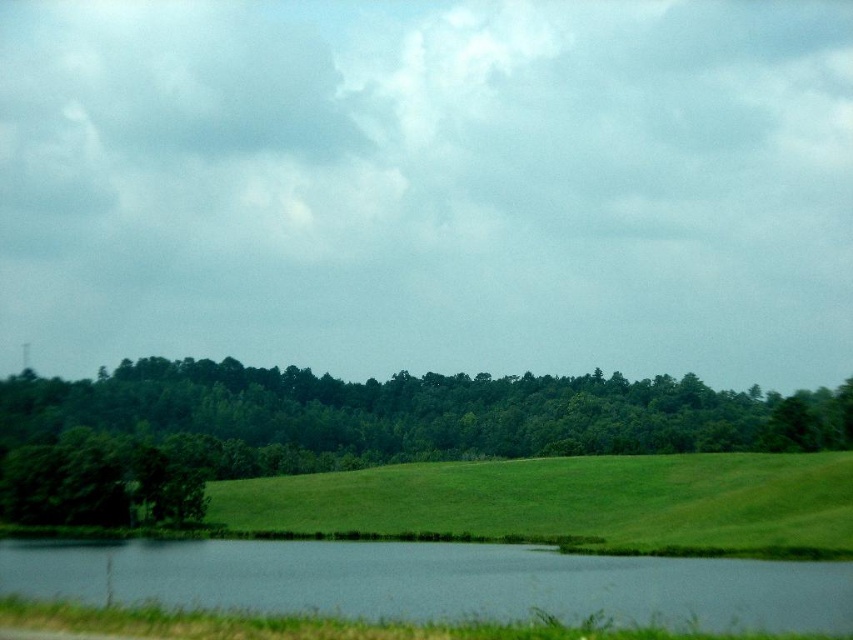
Question: Which point is farther from the camera taking this photo?

Choices:
 (A) (676, 424)
 (B) (788, 579)

Answer: (A)

Question: From the image, what is the correct spatial relationship of green leafy trees at center in relation to green grassy lake at lower center?

Choices:
 (A) above
 (B) below

Answer: (B)

Question: Which object is farther from the camera taking this photo?

Choices:
 (A) green leafy trees at center
 (B) green grassy lake at lower center

Answer: (A)

Question: Is green leafy trees at center further to camera compared to green grassy lake at lower center?

Choices:
 (A) no
 (B) yes

Answer: (B)

Question: Is green leafy trees at center closer to camera compared to green grassy lake at lower center?

Choices:
 (A) no
 (B) yes

Answer: (A)